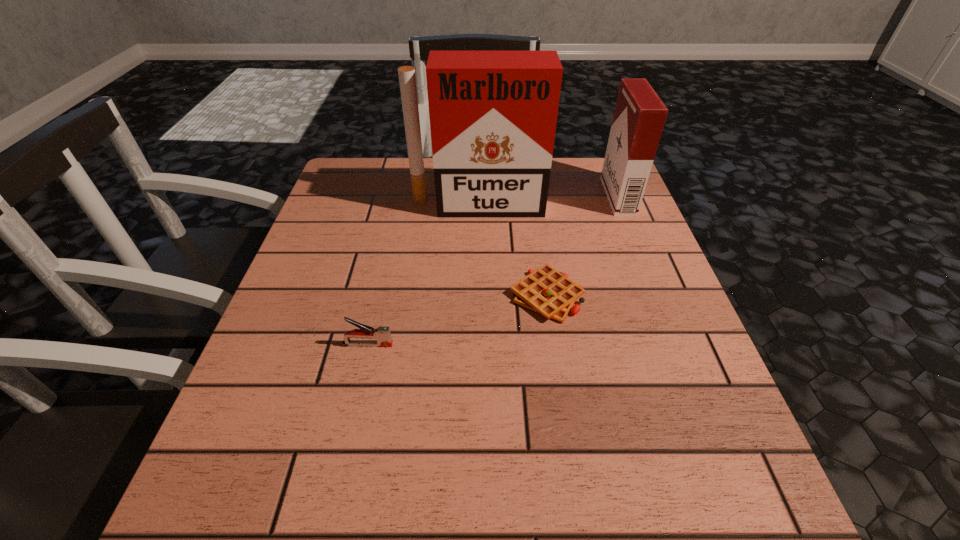
Identify the location of vacant space located 0.090m on the front-facing side of the right cigarette_case. This screenshot has height=540, width=960. (572, 196).

Locate an element on the screen. This screenshot has height=540, width=960. vacant space located on the front-facing side of the right cigarette_case is located at coordinates (552, 196).

This screenshot has height=540, width=960. I want to click on vacant space positioned on the handle side of the stapler, so click(465, 345).

Where is `free region located on the front of the third farthest object`? This screenshot has width=960, height=540. free region located on the front of the third farthest object is located at coordinates (582, 531).

Locate an element on the screen. The height and width of the screenshot is (540, 960). object that is at the left edge is located at coordinates (382, 334).

The height and width of the screenshot is (540, 960). What are the coordinates of `object situated at the right edge` in the screenshot? It's located at (639, 116).

Where is `object located in the far right corner section of the desktop`? The width and height of the screenshot is (960, 540). object located in the far right corner section of the desktop is located at coordinates (639, 116).

In the image, there is a desktop. Where is `free region at the far edge`? This screenshot has width=960, height=540. free region at the far edge is located at coordinates (430, 206).

This screenshot has height=540, width=960. In order to click on vacant space at the left edge of the desktop in this screenshot , I will do `click(357, 225)`.

Identify the location of free space at the right edge of the desktop. This screenshot has height=540, width=960. (579, 214).